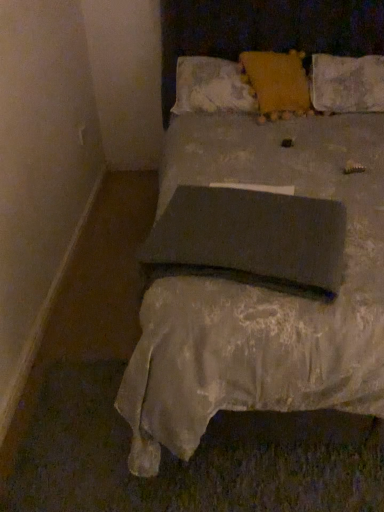
Question: Considering the positions of point (261, 92) and point (185, 98), is point (261, 92) closer or farther from the camera than point (185, 98)?

Choices:
 (A) closer
 (B) farther

Answer: (A)

Question: Is velvet orange pillow at upper center, which is counted as the 3th pillow, starting from the back, inside or outside of fluffy white pillow at upper center, the 4th pillow viewed from the front?

Choices:
 (A) outside
 (B) inside

Answer: (B)

Question: Estimate the real-world distances between objects in this image. Which object is closer to the matte gray bed at center?

Choices:
 (A) fluffy white pillow at upper center, the first pillow viewed from the back
 (B) dark gray fabric pillow at center, placed as the fourth pillow when sorted from back to front
 (C) textured beige pillow at upper right, which ranks as the 2th pillow in back-to-front order
 (D) velvet orange pillow at upper center, the second pillow positioned from the front

Answer: (B)

Question: Estimate the real-world distances between objects in this image. Which object is closer to the fluffy white pillow at upper center, the 4th pillow viewed from the front?

Choices:
 (A) velvet orange pillow at upper center, the second pillow positioned from the front
 (B) matte gray bed at center
 (C) dark gray fabric pillow at center, the 1th pillow from the front
 (D) textured beige pillow at upper right, which ranks as the 2th pillow in back-to-front order

Answer: (A)